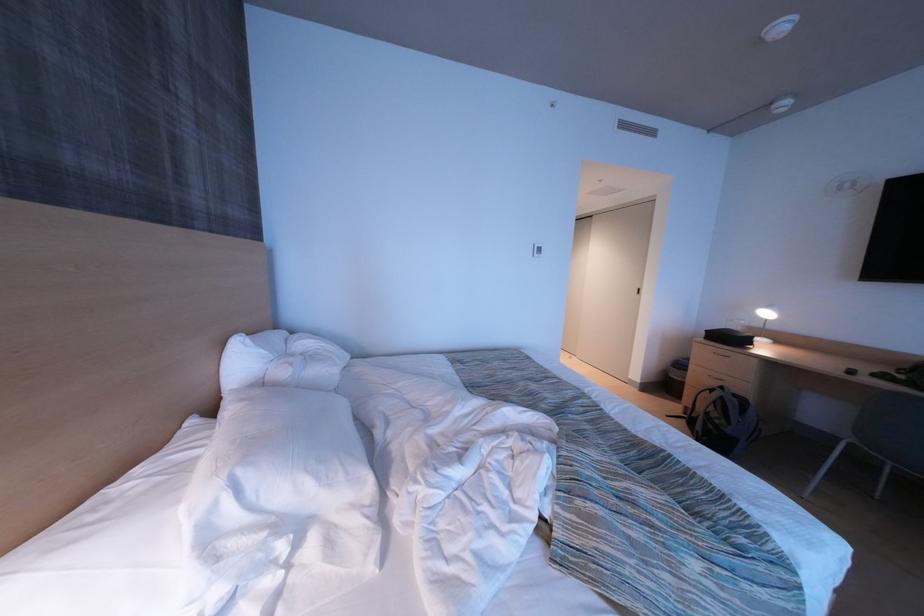
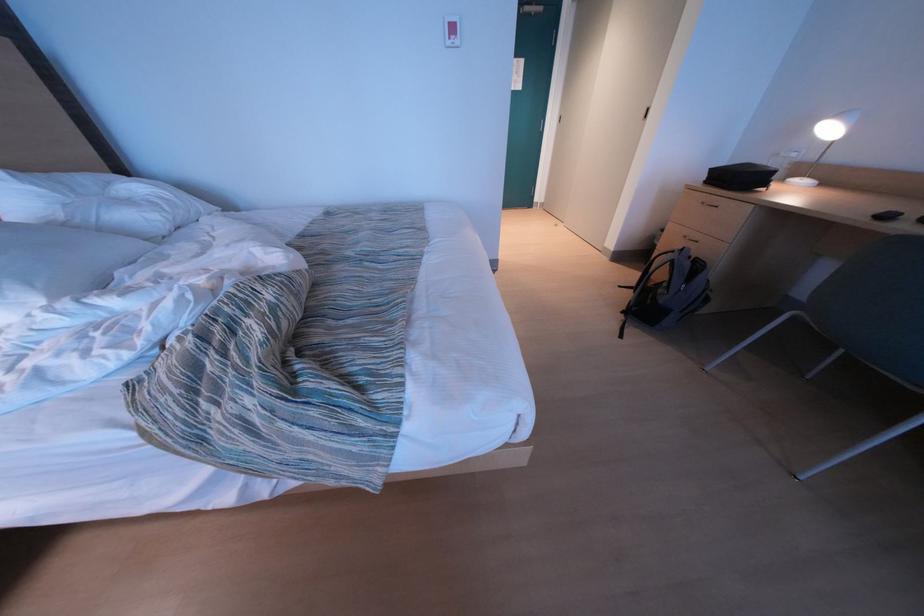
Question: In a continuous first-person perspective shot, in which direction is the camera moving?

Choices:
 (A) Left
 (B) Right
 (C) Forward
 (D) Backward

Answer: (B)